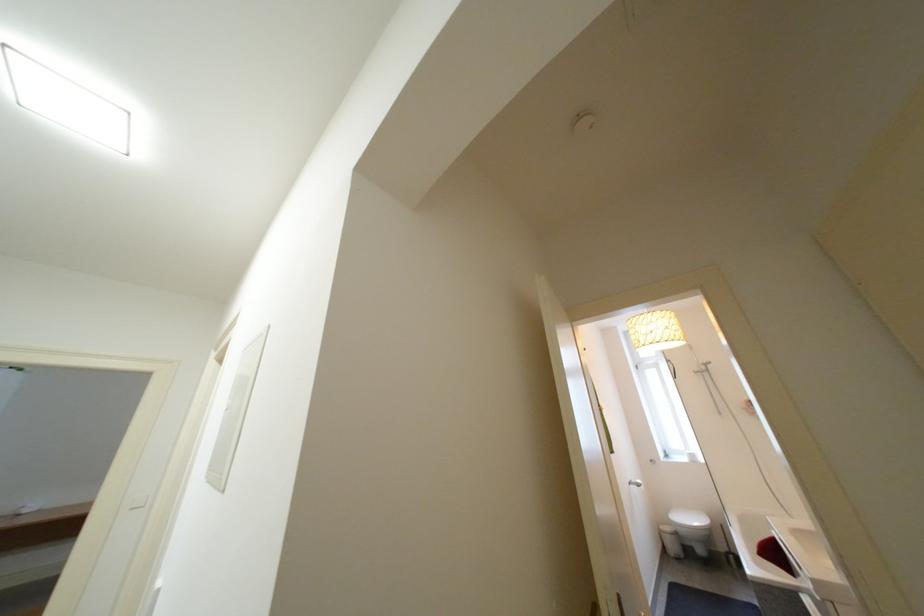
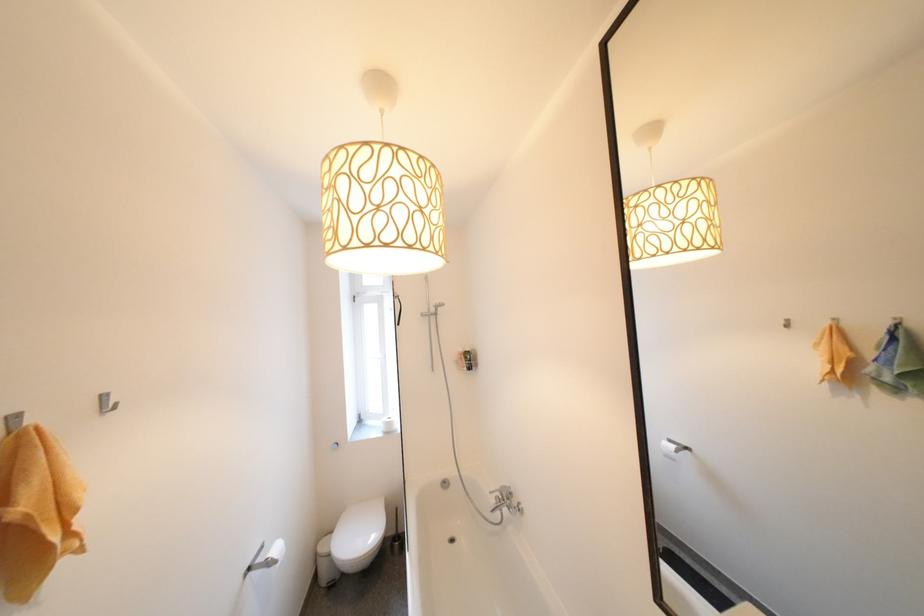
In the second image, find the point that corresponds to (675,549) in the first image.

(325, 578)